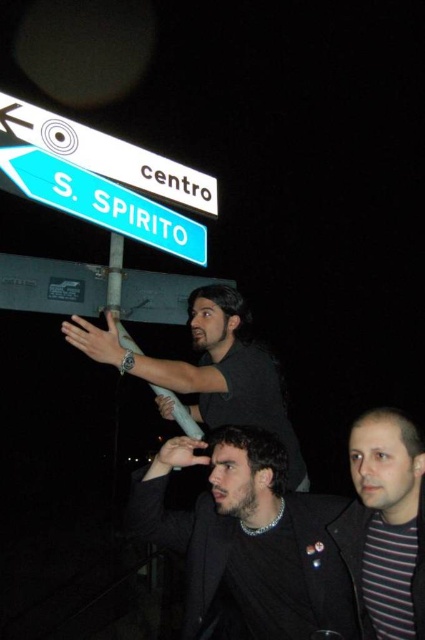
You are a photographer trying to capture the black matte shirt at upper center and the green plastic street sign at upper center in a single frame. Which object will appear taller in your photo?

The black matte shirt at upper center appears taller than the green plastic street sign at upper center in the photo.

You are a delivery person carrying a package that requires a minimum of 30 inches of space to maneuver. You see the dark brown leather jacket at center and the striped cotton shirt at lower right. Can you safely navigate between them with your package?

The distance between the dark brown leather jacket at center and the striped cotton shirt at lower right is 26.76 inches, which is less than the required 30 inches. Therefore, you cannot safely navigate between them with your package.

You are a photographer standing in front of the street sign. You want to take a photo that includes both the dark brown leather jacket at center and the striped cotton shirt at lower right. Which object will appear closer to you in the photo?

The dark brown leather jacket at center will appear closer to you in the photo because it is further to the viewer than the striped cotton shirt at lower right.